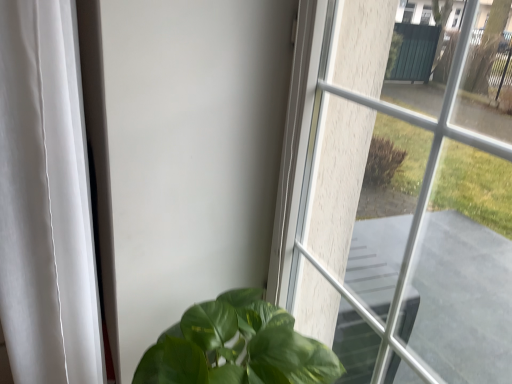
Question: From the image's perspective, is clear glass window at center positioned above or below white fabric curtain at left?

Choices:
 (A) above
 (B) below

Answer: (A)

Question: Visually, is clear glass window at center positioned to the left or to the right of white fabric curtain at left?

Choices:
 (A) right
 (B) left

Answer: (A)

Question: Would you say clear glass window at center is inside or outside white fabric curtain at left?

Choices:
 (A) outside
 (B) inside

Answer: (A)

Question: From their relative heights in the image, would you say white fabric curtain at left is taller or shorter than clear glass window at center?

Choices:
 (A) tall
 (B) short

Answer: (A)

Question: Looking at the image, does white fabric curtain at left seem bigger or smaller compared to clear glass window at center?

Choices:
 (A) small
 (B) big

Answer: (B)

Question: Is white fabric curtain at left in front of or behind clear glass window at center in the image?

Choices:
 (A) behind
 (B) front

Answer: (A)

Question: From the image's perspective, relative to clear glass window at center, is white fabric curtain at left above or below?

Choices:
 (A) below
 (B) above

Answer: (A)